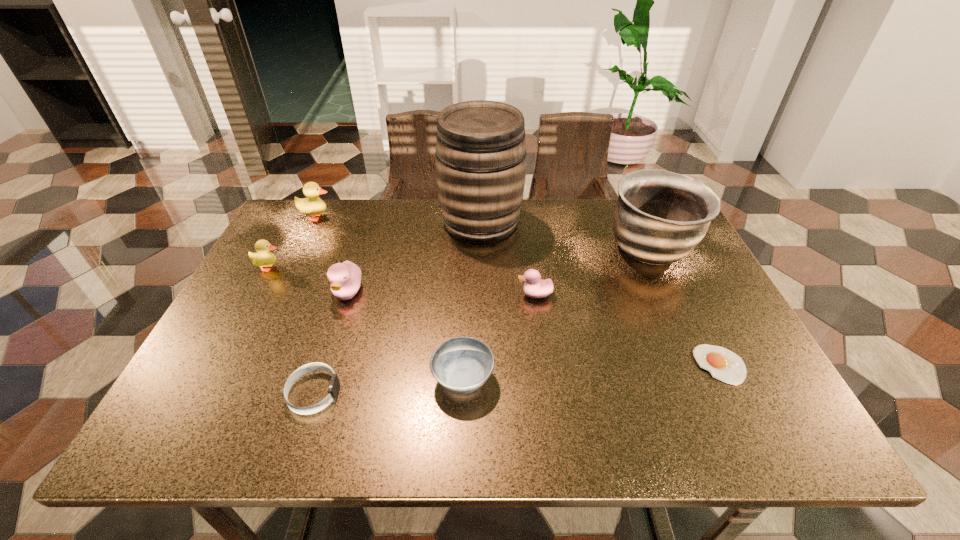
You are a GUI agent. You are given a task and a screenshot of the screen. Output one action in this format:
    pyautogui.click(x=<x>, y=<y>)
    Task: Click on the egg yolk located at the right edge
    
    Given the screenshot: What is the action you would take?
    pyautogui.click(x=723, y=364)

Image resolution: width=960 pixels, height=540 pixels. Identify the location of object present at the far left corner. pyautogui.click(x=313, y=205).

Find the location of `object present at the far right corner`. object present at the far right corner is located at coordinates (660, 216).

In the image, there is a desktop. Where is `vacant space at the far edge`? The width and height of the screenshot is (960, 540). vacant space at the far edge is located at coordinates (405, 209).

Locate an element on the screen. free space at the near edge of the desktop is located at coordinates (499, 436).

This screenshot has width=960, height=540. I want to click on vacant space at the left edge, so click(247, 352).

At what (x,y) coordinates should I click in order to perform the action: click on vacant area at the right edge. Please return your answer as a coordinate pair (x, y). Looking at the image, I should click on (699, 290).

At what (x,y) coordinates should I click in order to perform the action: click on free space at the far left corner of the desktop. Please return your answer as a coordinate pair (x, y). This screenshot has height=540, width=960. Looking at the image, I should click on (322, 223).

Where is `free point at the near left corner`? This screenshot has height=540, width=960. free point at the near left corner is located at coordinates (233, 432).

This screenshot has height=540, width=960. Identify the location of free location at the near right corner of the desktop. (788, 436).